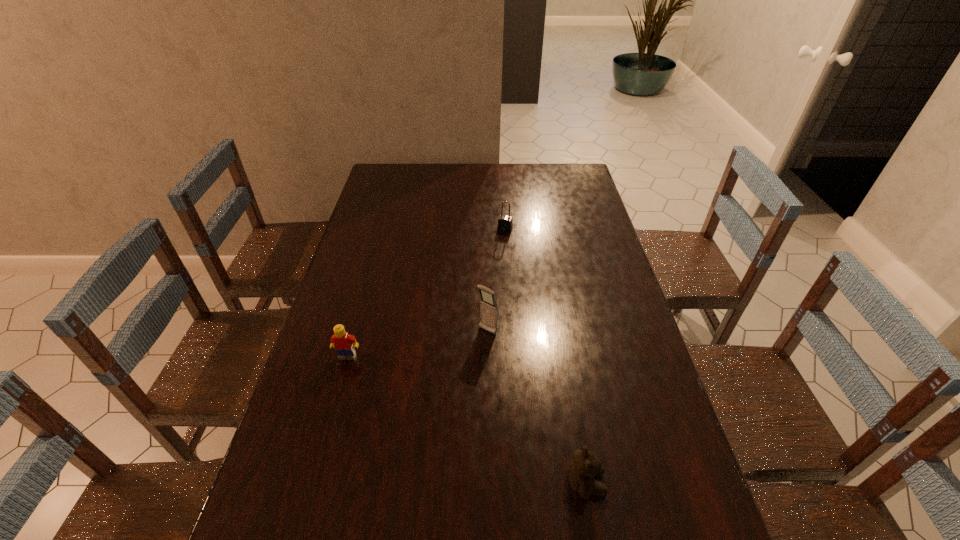
Where is `Lego`? The width and height of the screenshot is (960, 540). Lego is located at coordinates (344, 343).

Where is `the second nearest object`? The height and width of the screenshot is (540, 960). the second nearest object is located at coordinates 344,343.

In order to click on teddy bear in this screenshot , I will do `click(585, 468)`.

This screenshot has height=540, width=960. I want to click on the nearest object, so click(x=585, y=468).

This screenshot has width=960, height=540. What are the coordinates of `the third object from left to right` in the screenshot? It's located at (505, 223).

Find the location of a particular element. padlock is located at coordinates (505, 223).

This screenshot has width=960, height=540. I want to click on the tallest object, so click(x=489, y=310).

Image resolution: width=960 pixels, height=540 pixels. I want to click on the second farthest object, so click(x=489, y=310).

Where is `vacant space positioned on the front-facing side of the leftmost object`? This screenshot has height=540, width=960. vacant space positioned on the front-facing side of the leftmost object is located at coordinates (335, 399).

Where is `blank space located on the face of the nearest object`? The width and height of the screenshot is (960, 540). blank space located on the face of the nearest object is located at coordinates (689, 483).